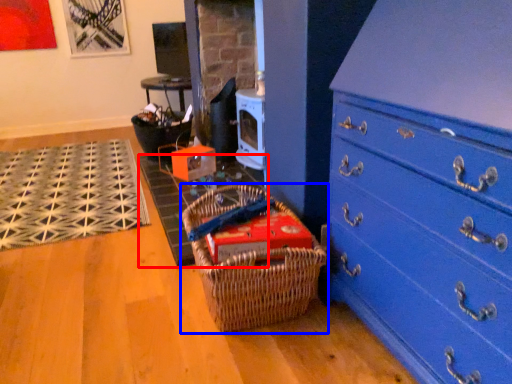
Question: Among these objects, which one is nearest to the camera, doormat (highlighted by a red box) or picnic basket (highlighted by a blue box)?

Choices:
 (A) doormat
 (B) picnic basket

Answer: (B)